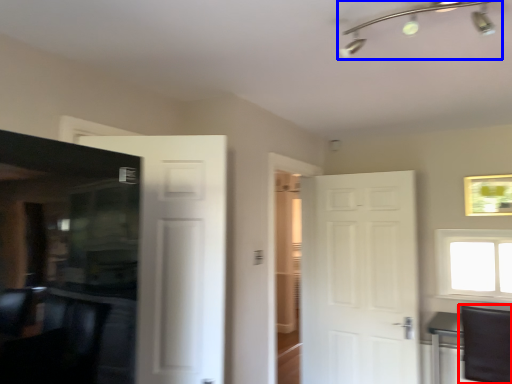
Question: Which of the following is the farthest to the observer, swivel chair (highlighted by a red box) or light fixture (highlighted by a blue box)?

Choices:
 (A) swivel chair
 (B) light fixture

Answer: (A)